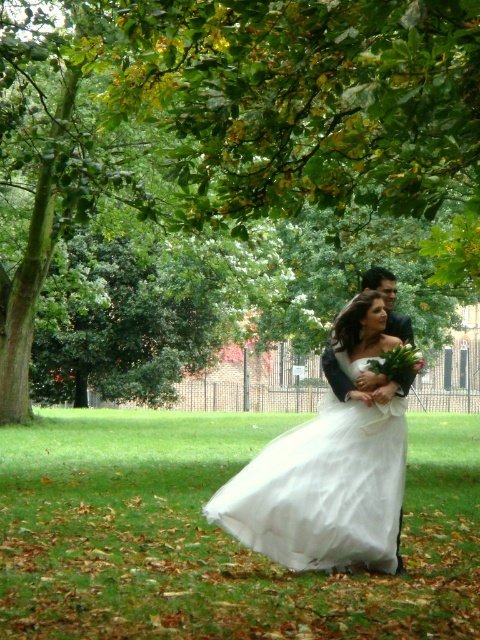
Question: Observing the image, what is the correct spatial positioning of green leafy tree at upper center in reference to white tulle dress at center?

Choices:
 (A) below
 (B) above

Answer: (B)

Question: Observing the image, what is the correct spatial positioning of green leafy tree at upper center in reference to white tulle dress at center?

Choices:
 (A) above
 (B) below

Answer: (A)

Question: Which object is closer to the camera taking this photo?

Choices:
 (A) green leafy tree at upper center
 (B) white tulle dress at center

Answer: (A)

Question: Which point appears farthest from the camera in this image?

Choices:
 (A) (232, 170)
 (B) (315, 508)

Answer: (A)

Question: Is green leafy tree at upper center below white tulle dress at center?

Choices:
 (A) no
 (B) yes

Answer: (A)

Question: Which object appears farthest from the camera in this image?

Choices:
 (A) green leafy tree at upper center
 (B) white tulle dress at center

Answer: (B)